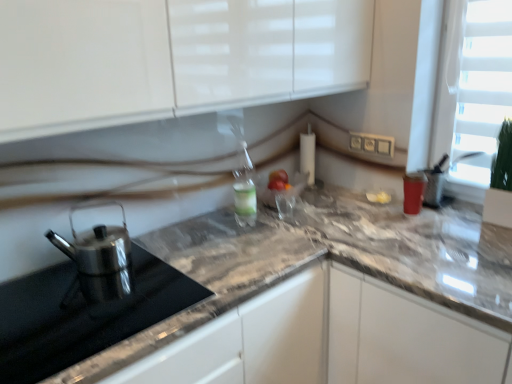
I want to click on blank space situated above polished stainless steel kettle at left (from a real-world perspective), so click(88, 307).